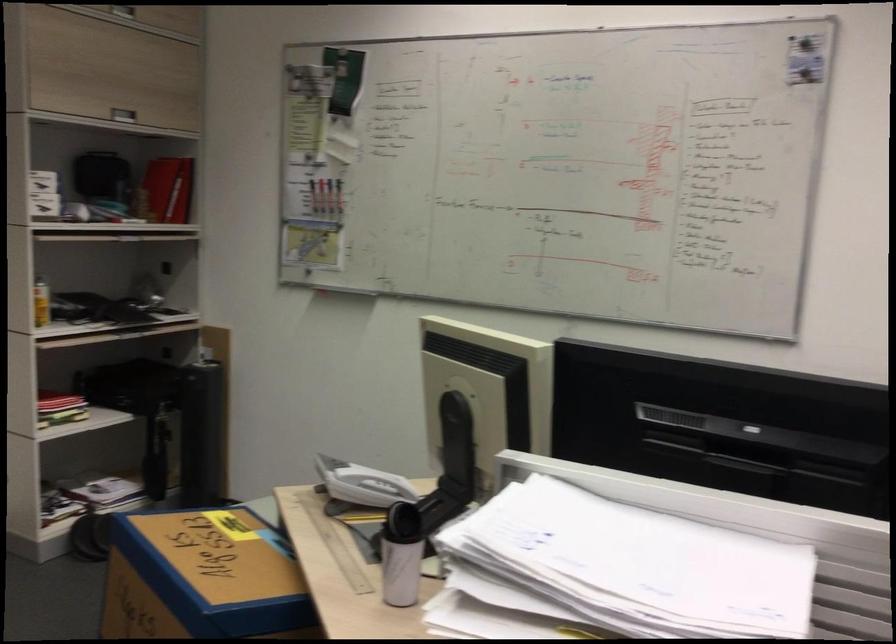
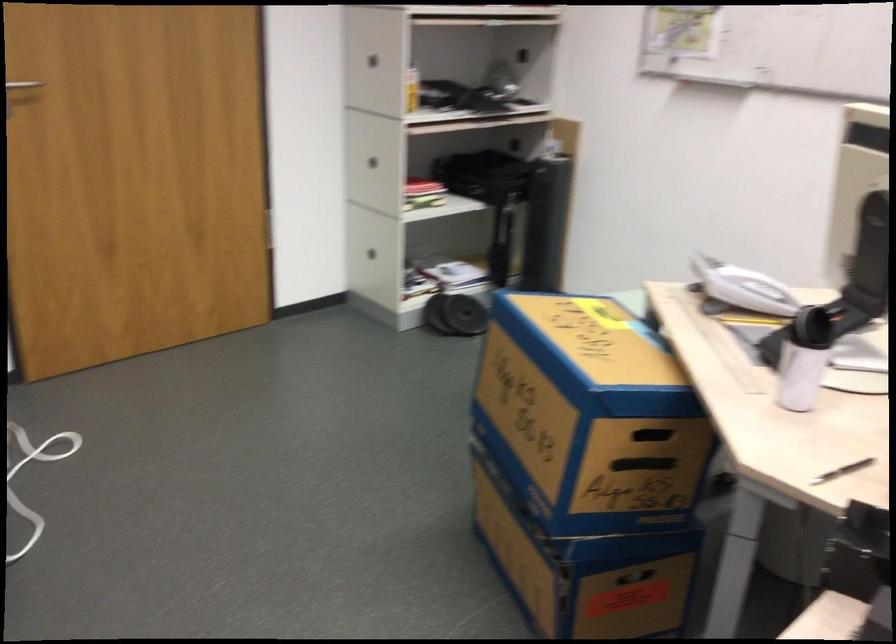
Question: The camera is either moving clockwise (left) or counter-clockwise (right) around the object. The first image is from the beginning of the video and the second image is from the end. Is the camera moving left or right when shooting the video?

Choices:
 (A) Left
 (B) Right

Answer: (B)